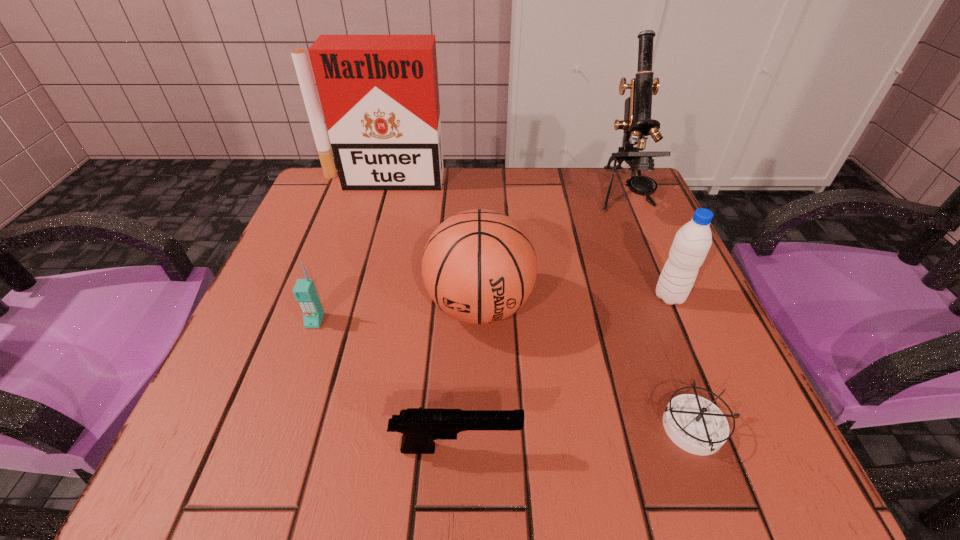
Where is `microscope at the right edge`? The width and height of the screenshot is (960, 540). microscope at the right edge is located at coordinates (637, 123).

Find the location of `water bottle at the right edge`. water bottle at the right edge is located at coordinates (691, 244).

Locate an element on the screen. Image resolution: width=960 pixels, height=540 pixels. compass at the right edge is located at coordinates (696, 425).

The image size is (960, 540). Identify the location of object that is at the far left corner. (379, 94).

Find the location of a particular element. object located at the far right corner is located at coordinates pyautogui.click(x=637, y=123).

I want to click on object located at the near right corner, so click(696, 425).

What are the coordinates of `vacant point at the far edge` in the screenshot? It's located at (582, 212).

The width and height of the screenshot is (960, 540). What are the coordinates of `free region at the left edge` in the screenshot? It's located at (311, 238).

Identify the location of free spot at the far left corner of the desktop. The width and height of the screenshot is (960, 540). (334, 190).

This screenshot has height=540, width=960. In order to click on free space at the far right corner of the desktop in this screenshot , I will do `click(585, 172)`.